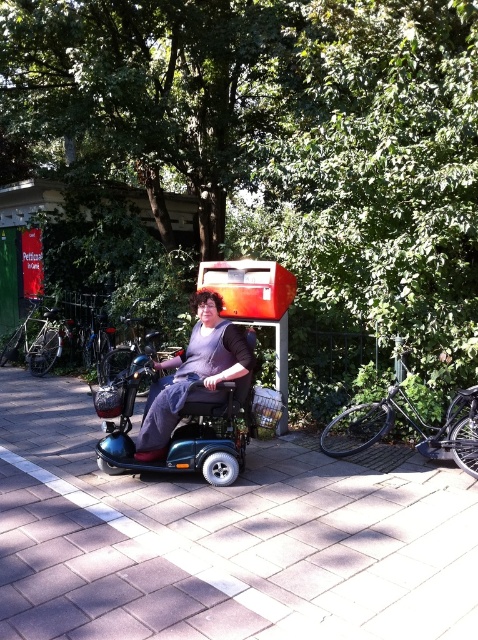
Based on the photo, you are standing at the edge of a brick pavement at center. You want to walk to a bench that is 10 feet away from where you are now. Can you reach the bench without stepping onto the brick pavement?

The brick pavement at center and viewer are 8.48 feet apart. Since the bench is 10 feet away from your current position, you would need to walk past the brick pavement to reach it. Therefore, you would have to step onto the brick pavement to reach the bench.

You are standing at the point marked by the coordinates (221,540) in the image. What type of surface are you currently standing on?

The brick pavement at center is represented by point (221,540), so you are standing on brick pavement.

You are a delivery person who needs to park your bike near the brick pavement at center. The black matte bicycle at right is already parked there. Can you park your bike next to it without moving the existing bike?

The brick pavement at center is closer to the viewer than the black matte bicycle at right, so there might not be enough space to park next to it without moving the existing bike.